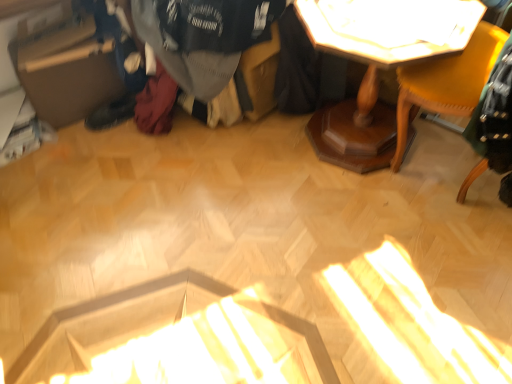
Question: Considering the relative sizes of matte yellow chair at upper right and dark gray sweater at center in the image provided, is matte yellow chair at upper right thinner than dark gray sweater at center?

Choices:
 (A) no
 (B) yes

Answer: (B)

Question: Is matte yellow chair at upper right oriented away from dark gray sweater at center?

Choices:
 (A) yes
 (B) no

Answer: (B)

Question: From a real-world perspective, is matte yellow chair at upper right physically above dark gray sweater at center?

Choices:
 (A) no
 (B) yes

Answer: (A)

Question: From the image's perspective, would you say matte yellow chair at upper right is shown under dark gray sweater at center?

Choices:
 (A) no
 (B) yes

Answer: (B)

Question: Is dark gray sweater at center located within matte yellow chair at upper right?

Choices:
 (A) no
 (B) yes

Answer: (A)

Question: Does point (74, 49) appear closer or farther from the camera than point (434, 109)?

Choices:
 (A) closer
 (B) farther

Answer: (B)

Question: Looking at their shapes, would you say brown cardboard box at left is wider or thinner than matte yellow chair at upper right?

Choices:
 (A) wide
 (B) thin

Answer: (B)

Question: Considering their positions, is brown cardboard box at left located in front of or behind matte yellow chair at upper right?

Choices:
 (A) front
 (B) behind

Answer: (B)

Question: From a real-world perspective, is brown cardboard box at left above or below matte yellow chair at upper right?

Choices:
 (A) above
 (B) below

Answer: (B)

Question: Which is correct: dark gray sweater at center is inside white glossy table at upper center, or outside of it?

Choices:
 (A) outside
 (B) inside

Answer: (A)

Question: Is point (162, 51) positioned closer to the camera than point (361, 34)?

Choices:
 (A) farther
 (B) closer

Answer: (A)

Question: From a real-world perspective, is dark gray sweater at center above or below white glossy table at upper center?

Choices:
 (A) below
 (B) above

Answer: (A)

Question: Considering the positions of dark gray sweater at center and white glossy table at upper center in the image, is dark gray sweater at center wider or thinner than white glossy table at upper center?

Choices:
 (A) thin
 (B) wide

Answer: (B)

Question: In terms of width, does matte yellow chair at upper right look wider or thinner when compared to wooden table at upper right?

Choices:
 (A) thin
 (B) wide

Answer: (A)

Question: Would you say matte yellow chair at upper right is inside or outside wooden table at upper right?

Choices:
 (A) inside
 (B) outside

Answer: (B)